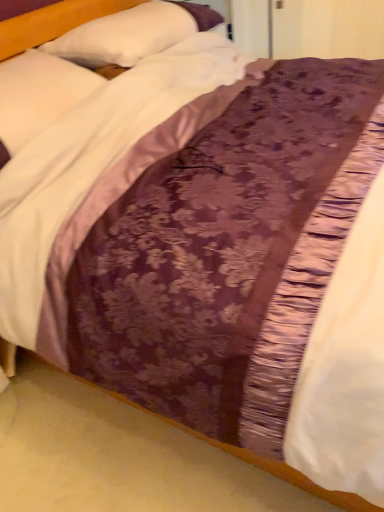
What is the approximate height of white satin pillow at upper left, which is counted as the 1th pillow, starting from the bottom?

white satin pillow at upper left, which is counted as the 1th pillow, starting from the bottom, is 9.74 inches tall.

Where is `white satin pillow at upper left, which is counted as the 1th pillow, starting from the bottom`? white satin pillow at upper left, which is counted as the 1th pillow, starting from the bottom is located at coordinates (38, 96).

Describe the element at coordinates (38, 96) in the screenshot. I see `white satin pillow at upper left, which is counted as the 1th pillow, starting from the bottom` at that location.

In order to face white satin pillow at upper center, placed as the first pillow when sorted from top to bottom, should I rotate leftwards or rightwards?

You should rotate left by 6.588 degrees.

Describe the element at coordinates (132, 34) in the screenshot. I see `white satin pillow at upper center, placed as the first pillow when sorted from top to bottom` at that location.

You are a GUI agent. You are given a task and a screenshot of the screen. Output one action in this format:
    pyautogui.click(x=<x>, y=<y>)
    Task: Click on the white satin pillow at upper center, placed as the first pillow when sorted from top to bottom
    This screenshot has height=512, width=384.
    Given the screenshot: What is the action you would take?
    pyautogui.click(x=132, y=34)

Where is `white satin pillow at upper left, which is the 2th pillow from top to bottom`? This screenshot has height=512, width=384. white satin pillow at upper left, which is the 2th pillow from top to bottom is located at coordinates (38, 96).

Does white satin pillow at upper center, the second pillow ordered from the bottom, appear on the right side of white satin pillow at upper left, which is the 2th pillow from top to bottom?

Indeed, white satin pillow at upper center, the second pillow ordered from the bottom, is positioned on the right side of white satin pillow at upper left, which is the 2th pillow from top to bottom.

Is white satin pillow at upper center, the second pillow ordered from the bottom, positioned in front of white satin pillow at upper left, which is the 2th pillow from top to bottom?

That is False.

Is point (94, 40) behind point (24, 78)?

Yes, point (94, 40) is farther from viewer.

Looking at this image, from the image's perspective, who appears lower, white satin pillow at upper center, placed as the first pillow when sorted from top to bottom, or white satin pillow at upper left, which is counted as the 1th pillow, starting from the bottom?

white satin pillow at upper left, which is counted as the 1th pillow, starting from the bottom, appears lower in the image.

Looking at this image, from a real-world perspective, is white satin pillow at upper center, placed as the first pillow when sorted from top to bottom, on top of white satin pillow at upper left, which is the 2th pillow from top to bottom?

Yes.

In terms of width, does white satin pillow at upper center, placed as the first pillow when sorted from top to bottom, look wider or thinner when compared to white satin pillow at upper left, which is counted as the 1th pillow, starting from the bottom?

Considering their sizes, white satin pillow at upper center, placed as the first pillow when sorted from top to bottom, looks slimmer than white satin pillow at upper left, which is counted as the 1th pillow, starting from the bottom.

Which of these two, white satin pillow at upper center, the second pillow ordered from the bottom, or white satin pillow at upper left, which is counted as the 1th pillow, starting from the bottom, stands shorter?

Standing shorter between the two is white satin pillow at upper center, the second pillow ordered from the bottom.

Does white satin pillow at upper center, placed as the first pillow when sorted from top to bottom, have a smaller size compared to white satin pillow at upper left, which is the 2th pillow from top to bottom?

Incorrect, white satin pillow at upper center, placed as the first pillow when sorted from top to bottom, is not smaller in size than white satin pillow at upper left, which is the 2th pillow from top to bottom.

From the picture: Does white satin pillow at upper center, placed as the first pillow when sorted from top to bottom, contain white satin pillow at upper left, which is the 2th pillow from top to bottom?

No.

Is white satin pillow at upper center, placed as the first pillow when sorted from top to bottom, placed right next to white satin pillow at upper left, which is counted as the 1th pillow, starting from the bottom?

white satin pillow at upper center, placed as the first pillow when sorted from top to bottom, and white satin pillow at upper left, which is counted as the 1th pillow, starting from the bottom, are not in contact.

Is white satin pillow at upper center, the second pillow ordered from the bottom, facing away from white satin pillow at upper left, which is counted as the 1th pillow, starting from the bottom?

No, white satin pillow at upper center, the second pillow ordered from the bottom, is not facing the opposite direction of white satin pillow at upper left, which is counted as the 1th pillow, starting from the bottom.

How different are the orientations of white satin pillow at upper center, the second pillow ordered from the bottom, and white satin pillow at upper left, which is counted as the 1th pillow, starting from the bottom, in degrees?

0.354 degrees separate the facing orientations of white satin pillow at upper center, the second pillow ordered from the bottom, and white satin pillow at upper left, which is counted as the 1th pillow, starting from the bottom.

How distant is white satin pillow at upper center, the second pillow ordered from the bottom, from white satin pillow at upper left, which is the 2th pillow from top to bottom?

A distance of 13.90 inches exists between white satin pillow at upper center, the second pillow ordered from the bottom, and white satin pillow at upper left, which is the 2th pillow from top to bottom.

This screenshot has height=512, width=384. Identify the location of pillow on the left of white satin pillow at upper center, placed as the first pillow when sorted from top to bottom. (38, 96).

Does white satin pillow at upper left, which is counted as the 1th pillow, starting from the bottom, appear on the right side of white satin pillow at upper center, placed as the first pillow when sorted from top to bottom?

In fact, white satin pillow at upper left, which is counted as the 1th pillow, starting from the bottom, is to the left of white satin pillow at upper center, placed as the first pillow when sorted from top to bottom.

Between white satin pillow at upper left, which is the 2th pillow from top to bottom, and white satin pillow at upper center, the second pillow ordered from the bottom, which one is positioned behind?

white satin pillow at upper center, the second pillow ordered from the bottom, is further from the camera.

Which is nearer, [43,129] or [202,15]?

Point [43,129]

From the picture: From the image's perspective, is white satin pillow at upper left, which is counted as the 1th pillow, starting from the bottom, above or below white satin pillow at upper center, the second pillow ordered from the bottom?

white satin pillow at upper left, which is counted as the 1th pillow, starting from the bottom, is below white satin pillow at upper center, the second pillow ordered from the bottom.

From a real-world perspective, relative to white satin pillow at upper center, placed as the first pillow when sorted from top to bottom, is white satin pillow at upper left, which is counted as the 1th pillow, starting from the bottom, vertically above or below?

Clearly, from a real-world perspective, white satin pillow at upper left, which is counted as the 1th pillow, starting from the bottom, is below white satin pillow at upper center, placed as the first pillow when sorted from top to bottom.

Consider the image. Looking at their sizes, would you say white satin pillow at upper left, which is counted as the 1th pillow, starting from the bottom, is wider or thinner than white satin pillow at upper center, the second pillow ordered from the bottom?

white satin pillow at upper left, which is counted as the 1th pillow, starting from the bottom, is wider than white satin pillow at upper center, the second pillow ordered from the bottom.

Considering the sizes of white satin pillow at upper left, which is the 2th pillow from top to bottom, and white satin pillow at upper center, placed as the first pillow when sorted from top to bottom, in the image, is white satin pillow at upper left, which is the 2th pillow from top to bottom, taller or shorter than white satin pillow at upper center, placed as the first pillow when sorted from top to bottom,?

Considering their sizes, white satin pillow at upper left, which is the 2th pillow from top to bottom, has more height than white satin pillow at upper center, placed as the first pillow when sorted from top to bottom.

Considering the relative sizes of white satin pillow at upper left, which is counted as the 1th pillow, starting from the bottom, and white satin pillow at upper center, the second pillow ordered from the bottom, in the image provided, is white satin pillow at upper left, which is counted as the 1th pillow, starting from the bottom, smaller than white satin pillow at upper center, the second pillow ordered from the bottom,?

Yes, white satin pillow at upper left, which is counted as the 1th pillow, starting from the bottom, is smaller than white satin pillow at upper center, the second pillow ordered from the bottom.

Looking at this image, would you say white satin pillow at upper left, which is counted as the 1th pillow, starting from the bottom, contains white satin pillow at upper center, the second pillow ordered from the bottom?

That's incorrect, white satin pillow at upper center, the second pillow ordered from the bottom, is not inside white satin pillow at upper left, which is counted as the 1th pillow, starting from the bottom.

Is white satin pillow at upper left, which is the 2th pillow from top to bottom, next to white satin pillow at upper center, the second pillow ordered from the bottom, and touching it?

No, white satin pillow at upper left, which is the 2th pillow from top to bottom, is not making contact with white satin pillow at upper center, the second pillow ordered from the bottom.

Is white satin pillow at upper left, which is counted as the 1th pillow, starting from the bottom, oriented towards white satin pillow at upper center, the second pillow ordered from the bottom?

No, white satin pillow at upper left, which is counted as the 1th pillow, starting from the bottom, is not aimed at white satin pillow at upper center, the second pillow ordered from the bottom.

Measure the distance between white satin pillow at upper left, which is counted as the 1th pillow, starting from the bottom, and white satin pillow at upper center, the second pillow ordered from the bottom.

13.90 inches.

The height and width of the screenshot is (512, 384). Identify the location of pillow that appears above the white satin pillow at upper left, which is the 2th pillow from top to bottom (from the image's perspective). (132, 34).

Identify the location of pillow above the white satin pillow at upper left, which is counted as the 1th pillow, starting from the bottom (from a real-world perspective). The height and width of the screenshot is (512, 384). (132, 34).

This screenshot has height=512, width=384. Find the location of `pillow that appears below the white satin pillow at upper center, the second pillow ordered from the bottom (from a real-world perspective)`. pillow that appears below the white satin pillow at upper center, the second pillow ordered from the bottom (from a real-world perspective) is located at coordinates (38, 96).